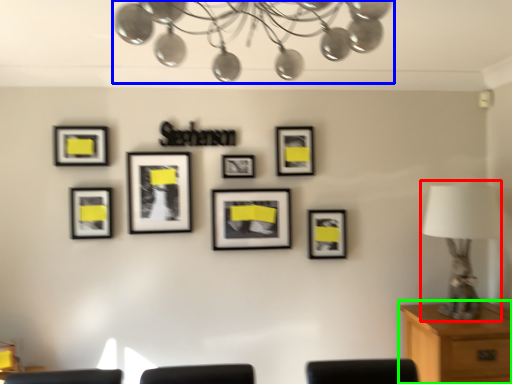
Question: Which object is positioned closest to table lamp (highlighted by a red box)? Select from lamp (highlighted by a blue box) and table (highlighted by a green box).

Choices:
 (A) lamp
 (B) table

Answer: (B)